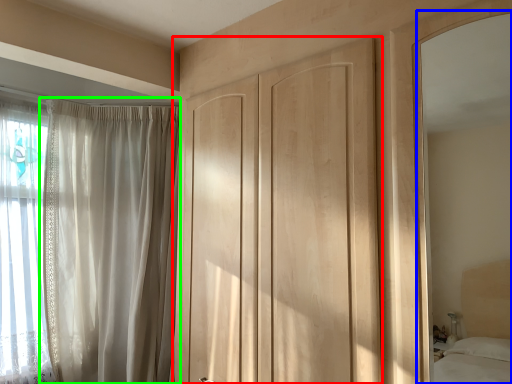
Question: Which object is positioned closest to door (highlighted by a red box)? Select from mirror (highlighted by a blue box) and curtain (highlighted by a green box).

Choices:
 (A) mirror
 (B) curtain

Answer: (B)